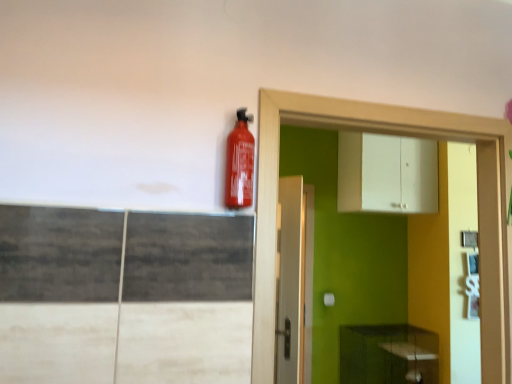
What do you see at coordinates (388, 355) in the screenshot?
I see `green matte cabinet at lower right, arranged as the second cabinetry when viewed from the top` at bounding box center [388, 355].

The width and height of the screenshot is (512, 384). Describe the element at coordinates (240, 163) in the screenshot. I see `matte red extinguisher at upper center` at that location.

This screenshot has height=384, width=512. Identify the location of white glossy dresser at upper right. (400, 134).

Is white matte cabinet at upper center, which is the first cabinetry in top-to-bottom order, oriented away from matte red extinguisher at upper center?

white matte cabinet at upper center, which is the first cabinetry in top-to-bottom order, is not turned away from matte red extinguisher at upper center.

Is white matte cabinet at upper center, acting as the second cabinetry starting from the bottom, positioned behind matte red extinguisher at upper center?

Yes, it is behind matte red extinguisher at upper center.

How many degrees apart are the facing directions of white matte cabinet at upper center, which is the first cabinetry in top-to-bottom order, and matte red extinguisher at upper center?

The angular difference between white matte cabinet at upper center, which is the first cabinetry in top-to-bottom order, and matte red extinguisher at upper center is 1.1 degrees.

Considering the relative positions of white matte cabinet at upper center, acting as the second cabinetry starting from the bottom, and matte red extinguisher at upper center in the image provided, is white matte cabinet at upper center, acting as the second cabinetry starting from the bottom, to the left of matte red extinguisher at upper center from the viewer's perspective?

No.

Can you see matte red extinguisher at upper center touching white matte cabinet at upper center, acting as the second cabinetry starting from the bottom?

No, matte red extinguisher at upper center is not touching white matte cabinet at upper center, acting as the second cabinetry starting from the bottom.

Does matte red extinguisher at upper center have a greater width compared to white matte cabinet at upper center, acting as the second cabinetry starting from the bottom?

No, matte red extinguisher at upper center is not wider than white matte cabinet at upper center, acting as the second cabinetry starting from the bottom.

Image resolution: width=512 pixels, height=384 pixels. What are the coordinates of `cabinetry lying above the matte red extinguisher at upper center (from the image's perspective)` in the screenshot? It's located at (387, 174).

Is matte red extinguisher at upper center to the left of white matte cabinet at upper center, acting as the second cabinetry starting from the bottom, from the viewer's perspective?

Indeed, matte red extinguisher at upper center is positioned on the left side of white matte cabinet at upper center, acting as the second cabinetry starting from the bottom.

Is white glossy dresser at upper right placed right next to green matte cabinet at lower right, arranged as the second cabinetry when viewed from the top?

No, white glossy dresser at upper right is not touching green matte cabinet at lower right, arranged as the second cabinetry when viewed from the top.

Is white glossy dresser at upper right taller than green matte cabinet at lower right, which appears as the 1th cabinetry when ordered from the bottom?

Yes.

How far apart are white glossy dresser at upper right and green matte cabinet at lower right, which appears as the 1th cabinetry when ordered from the bottom?

6.35 feet.

Is white glossy dresser at upper right not inside green matte cabinet at lower right, which appears as the 1th cabinetry when ordered from the bottom?

Indeed, white glossy dresser at upper right is completely outside green matte cabinet at lower right, which appears as the 1th cabinetry when ordered from the bottom.

Consider the image. Can you confirm if green matte cabinet at lower right, which appears as the 1th cabinetry when ordered from the bottom, is thinner than white matte cabinet at upper center, which is the first cabinetry in top-to-bottom order?

In fact, green matte cabinet at lower right, which appears as the 1th cabinetry when ordered from the bottom, might be wider than white matte cabinet at upper center, which is the first cabinetry in top-to-bottom order.

Which point is more distant from viewer, (404, 334) or (339, 192)?

Point (404, 334)

Is green matte cabinet at lower right, which appears as the 1th cabinetry when ordered from the bottom, next to white matte cabinet at upper center, which is the first cabinetry in top-to-bottom order?

No, green matte cabinet at lower right, which appears as the 1th cabinetry when ordered from the bottom, is not in contact with white matte cabinet at upper center, which is the first cabinetry in top-to-bottom order.

Which of these two, white matte cabinet at upper center, which is the first cabinetry in top-to-bottom order, or green matte cabinet at lower right, which appears as the 1th cabinetry when ordered from the bottom, is thinner?

Thinner between the two is white matte cabinet at upper center, which is the first cabinetry in top-to-bottom order.

Considering the sizes of objects white matte cabinet at upper center, which is the first cabinetry in top-to-bottom order, and green matte cabinet at lower right, which appears as the 1th cabinetry when ordered from the bottom, in the image provided, who is taller, white matte cabinet at upper center, which is the first cabinetry in top-to-bottom order, or green matte cabinet at lower right, which appears as the 1th cabinetry when ordered from the bottom,?

white matte cabinet at upper center, which is the first cabinetry in top-to-bottom order.

Considering the sizes of white matte cabinet at upper center, acting as the second cabinetry starting from the bottom, and green matte cabinet at lower right, which appears as the 1th cabinetry when ordered from the bottom, in the image, is white matte cabinet at upper center, acting as the second cabinetry starting from the bottom, bigger or smaller than green matte cabinet at lower right, which appears as the 1th cabinetry when ordered from the bottom,?

Clearly, white matte cabinet at upper center, acting as the second cabinetry starting from the bottom, is smaller in size than green matte cabinet at lower right, which appears as the 1th cabinetry when ordered from the bottom.

Would you say green matte cabinet at lower right, which appears as the 1th cabinetry when ordered from the bottom, is to the left or to the right of white glossy dresser at upper right in the picture?

From the image, it's evident that green matte cabinet at lower right, which appears as the 1th cabinetry when ordered from the bottom, is to the right of white glossy dresser at upper right.

How different are the orientations of green matte cabinet at lower right, arranged as the second cabinetry when viewed from the top, and white glossy dresser at upper right in degrees?

4.75 degrees.

Considering the sizes of green matte cabinet at lower right, which appears as the 1th cabinetry when ordered from the bottom, and white glossy dresser at upper right in the image, is green matte cabinet at lower right, which appears as the 1th cabinetry when ordered from the bottom, bigger or smaller than white glossy dresser at upper right?

Considering their sizes, green matte cabinet at lower right, which appears as the 1th cabinetry when ordered from the bottom, takes up more space than white glossy dresser at upper right.

Which is in front, point (389, 382) or point (254, 371)?

The point (254, 371) is in front.

Does matte red extinguisher at upper center appear on the right side of white glossy dresser at upper right?

In fact, matte red extinguisher at upper center is to the left of white glossy dresser at upper right.

From a real-world perspective, between matte red extinguisher at upper center and white glossy dresser at upper right, who is vertically higher?

From a 3D spatial view, matte red extinguisher at upper center is above.

In terms of height, does matte red extinguisher at upper center look taller or shorter compared to white glossy dresser at upper right?

Clearly, matte red extinguisher at upper center is shorter compared to white glossy dresser at upper right.

How far apart are matte red extinguisher at upper center and white glossy dresser at upper right?

A distance of 15.99 inches exists between matte red extinguisher at upper center and white glossy dresser at upper right.

The image size is (512, 384). What are the coordinates of `cabinetry that appears above the matte red extinguisher at upper center (from the image's perspective)` in the screenshot? It's located at (387, 174).

This screenshot has width=512, height=384. What are the coordinates of `extinguisher below the white matte cabinet at upper center, acting as the second cabinetry starting from the bottom (from a real-world perspective)` in the screenshot? It's located at (240, 163).

Looking at the image, which one is located further to green matte cabinet at lower right, which appears as the 1th cabinetry when ordered from the bottom, matte red extinguisher at upper center or white glossy dresser at upper right?

Among the two, matte red extinguisher at upper center is located further to green matte cabinet at lower right, which appears as the 1th cabinetry when ordered from the bottom.

Looking at the image, which one is located further to white glossy dresser at upper right, green matte cabinet at lower right, which appears as the 1th cabinetry when ordered from the bottom, or matte red extinguisher at upper center?

green matte cabinet at lower right, which appears as the 1th cabinetry when ordered from the bottom, is positioned further to the anchor white glossy dresser at upper right.

When comparing their distances from matte red extinguisher at upper center, does white glossy dresser at upper right or white matte cabinet at upper center, acting as the second cabinetry starting from the bottom, seem closer?

white glossy dresser at upper right is closer to matte red extinguisher at upper center.

Which object lies nearer to the anchor point white matte cabinet at upper center, which is the first cabinetry in top-to-bottom order, white glossy dresser at upper right or matte red extinguisher at upper center?

The object closer to white matte cabinet at upper center, which is the first cabinetry in top-to-bottom order, is white glossy dresser at upper right.

Looking at the image, which one is located closer to green matte cabinet at lower right, arranged as the second cabinetry when viewed from the top, matte red extinguisher at upper center or white matte cabinet at upper center, acting as the second cabinetry starting from the bottom?

The object closer to green matte cabinet at lower right, arranged as the second cabinetry when viewed from the top, is white matte cabinet at upper center, acting as the second cabinetry starting from the bottom.

Looking at the image, which one is located closer to green matte cabinet at lower right, which appears as the 1th cabinetry when ordered from the bottom, white glossy dresser at upper right or white matte cabinet at upper center, acting as the second cabinetry starting from the bottom?

The object closer to green matte cabinet at lower right, which appears as the 1th cabinetry when ordered from the bottom, is white matte cabinet at upper center, acting as the second cabinetry starting from the bottom.

Considering their positions, is matte red extinguisher at upper center positioned closer to white matte cabinet at upper center, acting as the second cabinetry starting from the bottom, than white glossy dresser at upper right?

white glossy dresser at upper right lies closer to white matte cabinet at upper center, acting as the second cabinetry starting from the bottom, than the other object.

Based on their spatial positions, is matte red extinguisher at upper center or white matte cabinet at upper center, acting as the second cabinetry starting from the bottom, further from white glossy dresser at upper right?

white matte cabinet at upper center, acting as the second cabinetry starting from the bottom, lies further to white glossy dresser at upper right than the other object.

Identify the location of cabinetry positioned between white glossy dresser at upper right and green matte cabinet at lower right, which appears as the 1th cabinetry when ordered from the bottom, from near to far. (387, 174).

At what (x,y) coordinates should I click in order to perform the action: click on cabinetry between matte red extinguisher at upper center and green matte cabinet at lower right, arranged as the second cabinetry when viewed from the top, from front to back. Please return your answer as a coordinate pair (x, y). This screenshot has height=384, width=512. Looking at the image, I should click on (387, 174).

I want to click on dresser between matte red extinguisher at upper center and green matte cabinet at lower right, arranged as the second cabinetry when viewed from the top, from front to back, so click(x=400, y=134).

Image resolution: width=512 pixels, height=384 pixels. I want to click on dresser between matte red extinguisher at upper center and white matte cabinet at upper center, acting as the second cabinetry starting from the bottom, in the front-back direction, so click(400, 134).